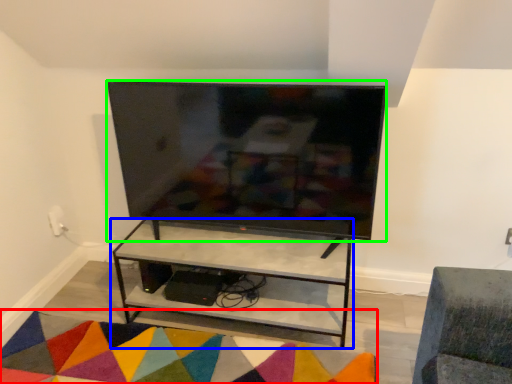
Question: Which is nearer to the mat (highlighted by a red box)? shelf (highlighted by a blue box) or television (highlighted by a green box).

Choices:
 (A) shelf
 (B) television

Answer: (A)